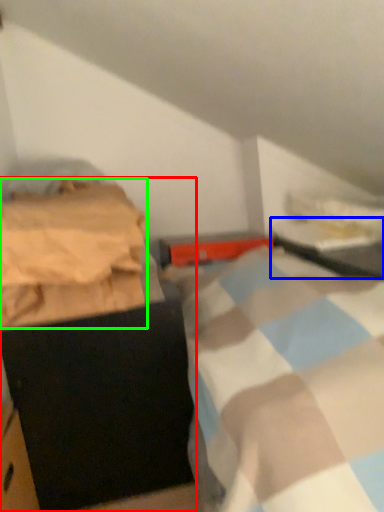
Question: Which is nearer to the furniture (highlighted by a red box)? table (highlighted by a blue box) or blanket (highlighted by a green box).

Choices:
 (A) table
 (B) blanket

Answer: (B)